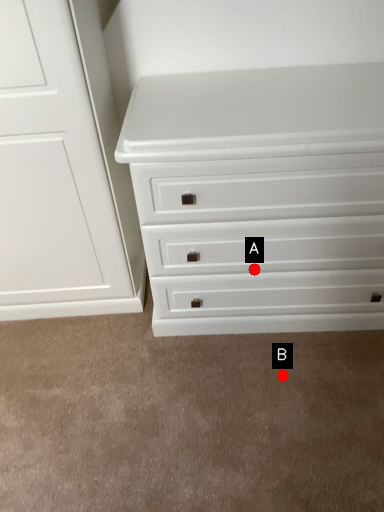
Question: Two points are circled on the image, labeled by A and B beside each circle. Which of the following is the closest to the observer?

Choices:
 (A) A is closer
 (B) B is closer

Answer: (A)